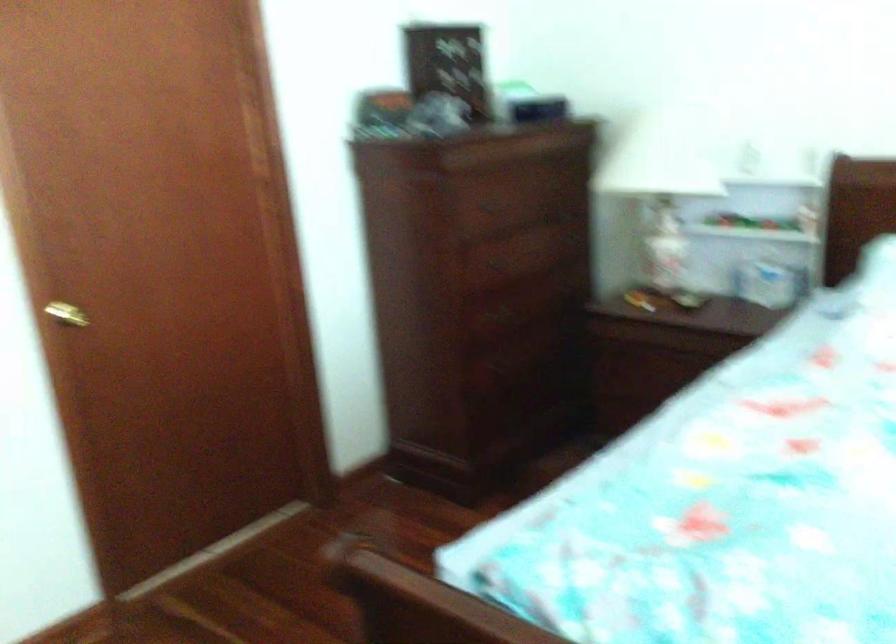
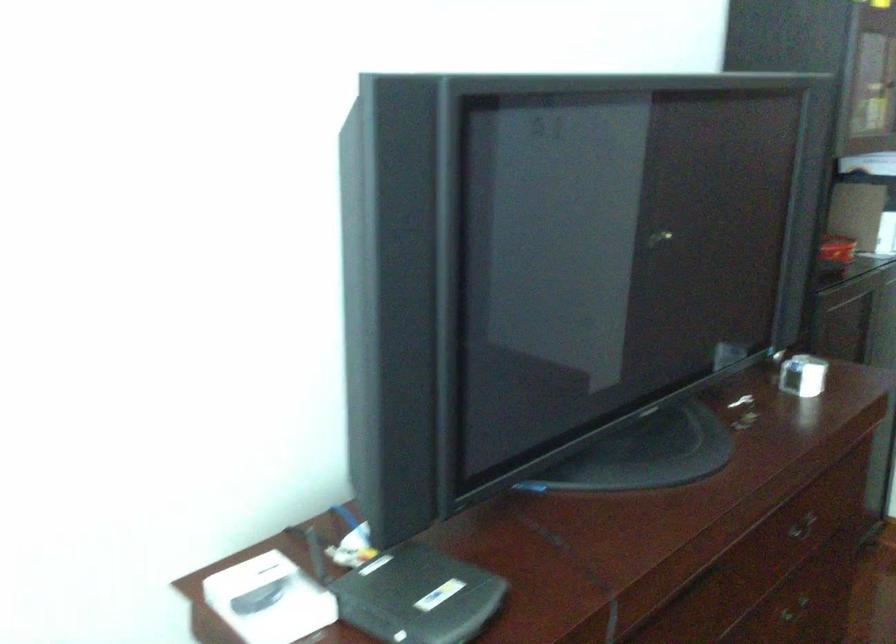
How did the camera likely rotate?

The rotation direction of the camera is left-down.